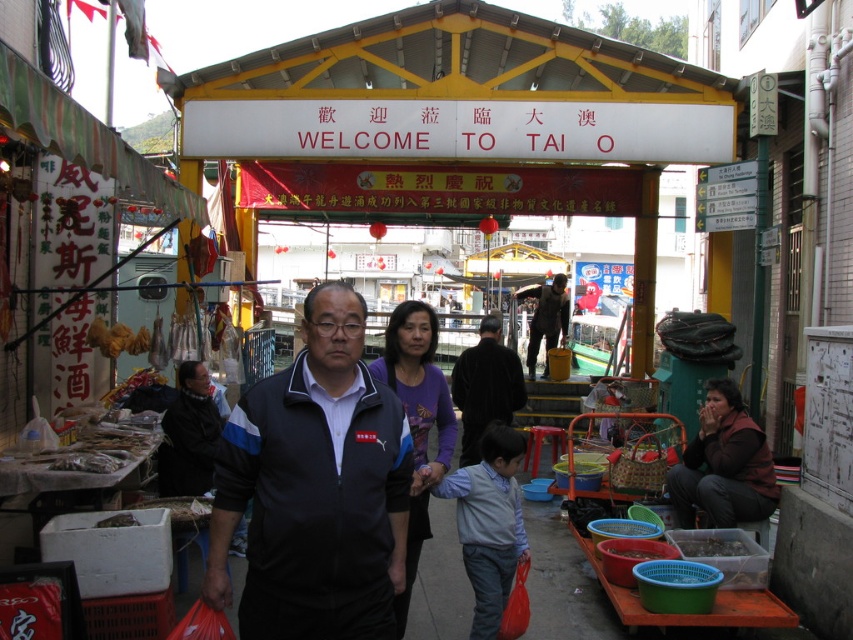
Who is more distant from viewer, [473,349] or [705,536]?

Point [473,349]

Between point (485, 333) and point (683, 541), which one is positioned in front?

Point (683, 541)

Between point (469, 426) and point (705, 552), which one is positioned in front?

Point (705, 552) is in front.

Where is `dark brown jacket at center`? The image size is (853, 640). dark brown jacket at center is located at coordinates (485, 387).

Is black fabric jacket at center further to camera compared to dark brown leather jacket at center?

No, it is in front of dark brown leather jacket at center.

Can you confirm if black fabric jacket at center is positioned below dark brown leather jacket at center?

Correct, black fabric jacket at center is located below dark brown leather jacket at center.

I want to click on black fabric jacket at center, so click(315, 488).

Between purple matte shirt at center and translucent plastic container at lower right, which one appears on the left side from the viewer's perspective?

purple matte shirt at center is more to the left.

Does purple matte shirt at center appear under translucent plastic container at lower right?

No.

Does point (445, 435) come farther from viewer compared to point (741, 552)?

No, it is not.

Identify the location of purple matte shirt at center. 416,420.